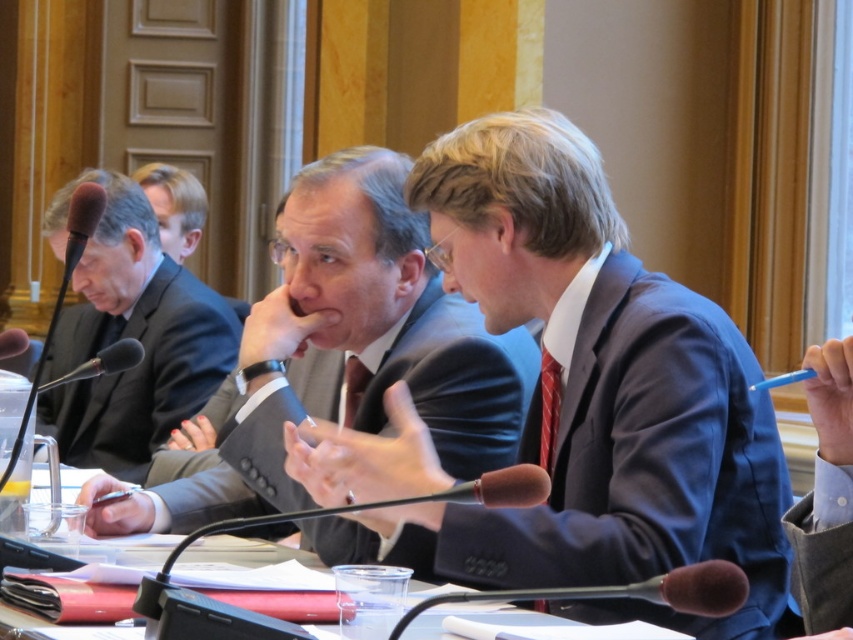
You are a photographer positioned behind the long table. You need to capture a photo of the blue suit at center and the black matte suit at left without any obstruction. Based on their positions, which person should you focus on first to ensure they are in the frame?

The blue suit at center is in front of the black matte suit at left, so you should focus on the blue suit at center first to ensure it is in the frame before adjusting for the black matte suit at left.

You are standing in the room where the meeting is taking place. You want to place a small plant on the table between the person on the left and the middle participant so that it is exactly 10 feet away from you. Is the point at coordinates (434, 220) on the table suitable for placing the plant?

The point at coordinates (434, 220) is 9.86 feet away from the viewer, which is slightly less than 10 feet. Therefore, placing the plant there would not meet the requirement of being exactly 10 feet away.

You are organizing a photo shoot and need to ensure that the blue suit at center and the dark gray suit at center are positioned exactly 20 inches apart for the camera frame. Based on the current setup, do you need to adjust their positions?

The current distance between the blue suit at center and the dark gray suit at center is 19.03 inches, which is slightly less than the required 20 inches. You should move them slightly apart to achieve the desired distance.